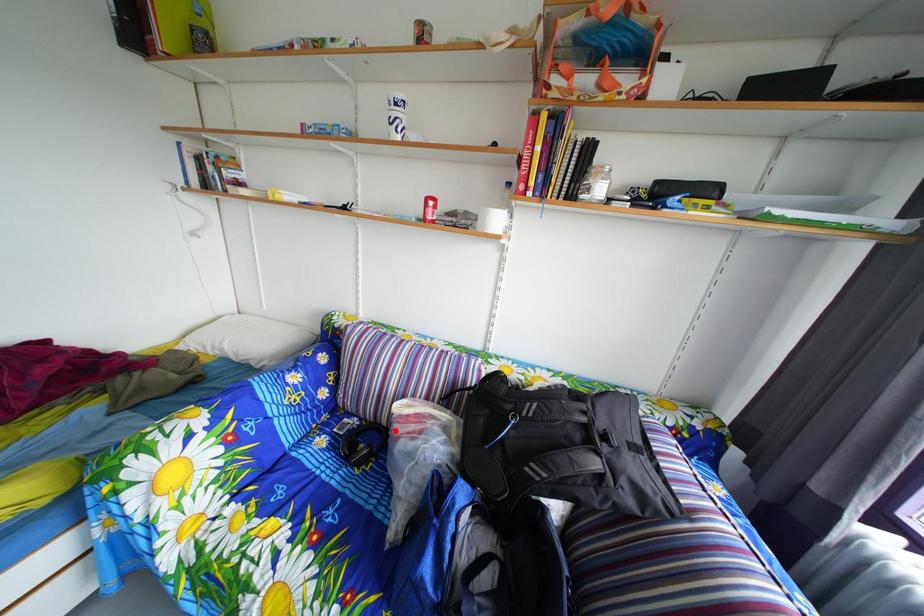
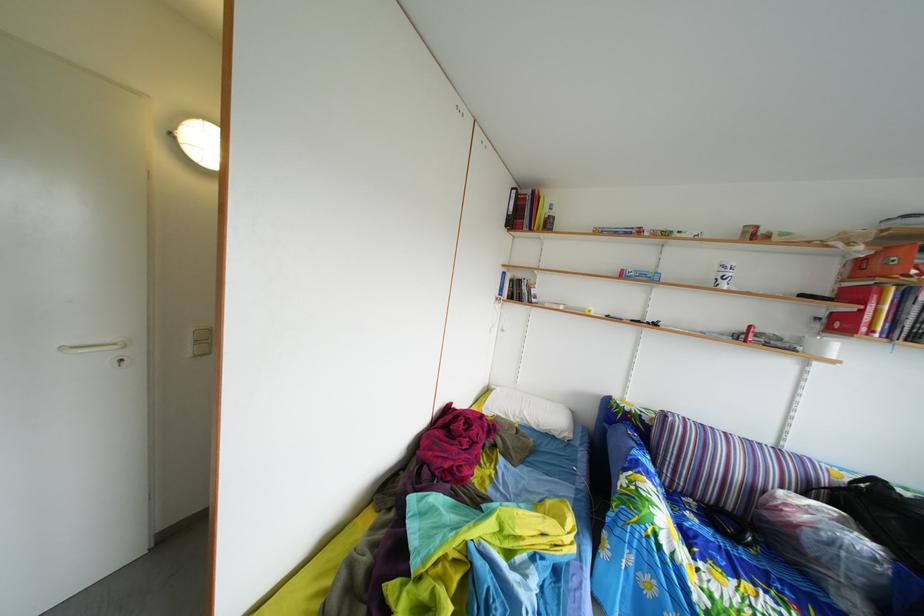
Question: I am providing you with two images of the same scene from different viewpoints. Image1 has a red point marked. In image2, the corresponding 3D location appears at what relative position? Reply with the corresponding letter.

Choices:
 (A) Closer
 (B) Farther

Answer: (A)